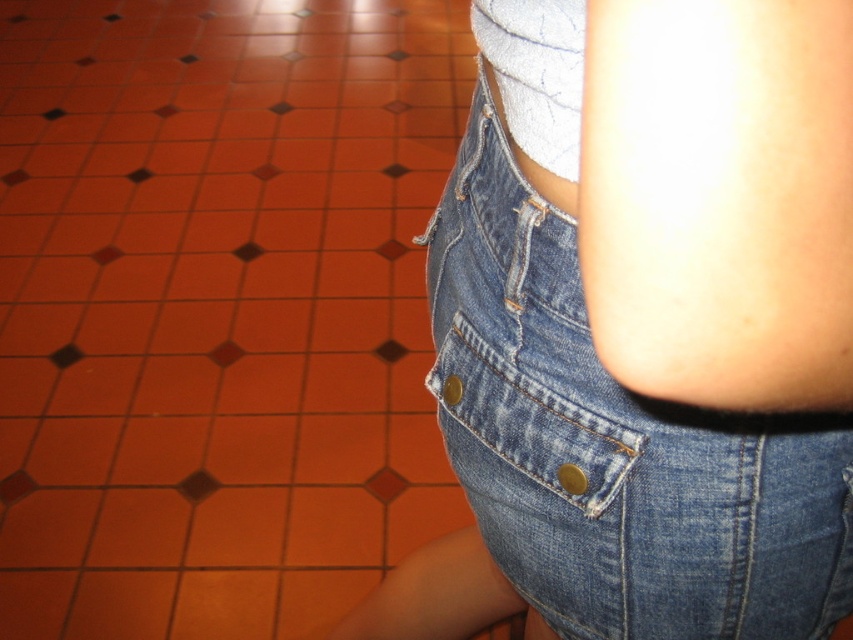
Question: Which of the following is the closest to the observer?

Choices:
 (A) denim shorts at center
 (B) orange tile at center

Answer: (A)

Question: In this image, where is denim shorts at center located relative to denim pocket at lower right?

Choices:
 (A) above
 (B) below

Answer: (A)

Question: Which of the following is the closest to the observer?

Choices:
 (A) denim pocket at lower right
 (B) orange tile at center

Answer: (A)

Question: Among these points, which one is nearest to the camera?

Choices:
 (A) (538, 460)
 (B) (143, 332)

Answer: (A)

Question: Can you confirm if orange tile at center is bigger than denim shorts at center?

Choices:
 (A) no
 (B) yes

Answer: (B)

Question: Can you confirm if orange tile at center is positioned to the left of denim shorts at center?

Choices:
 (A) no
 (B) yes

Answer: (B)